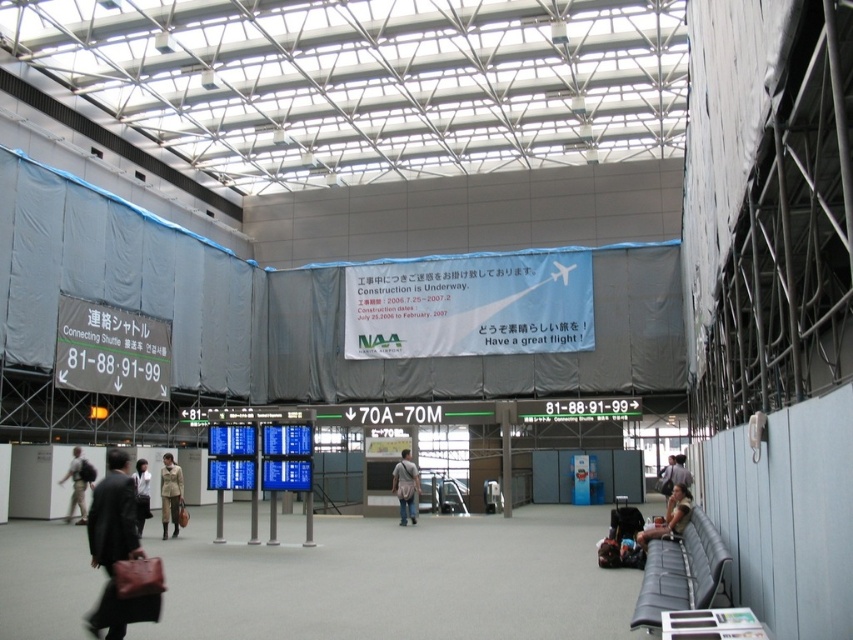
You are standing in the airport terminal near gates 70A to 70M and want to walk to the construction area marked by the blue tarps on the wall. There are two points marked on the floor at coordinates point [660,538] and point [140,532]. Which point should you stand on to be closer to the construction area?

You should stand on point [660,538] because it is in front of point [140,532], meaning it is closer to the construction area.

You are a traveler carrying a leather brown bag at lower left and you see a point at coordinates (115,548). Is the bag located at that point?

The point (115,548) corresponds to the leather brown bag at lower left, so yes, the bag is located at that point.

You are a traveler waiting at the airport terminal and see both the leather brown bag at lower left and the light brown leather jacket at lower left. Which item is taller?

The leather brown bag at lower left is taller than the light brown leather jacket at lower left.